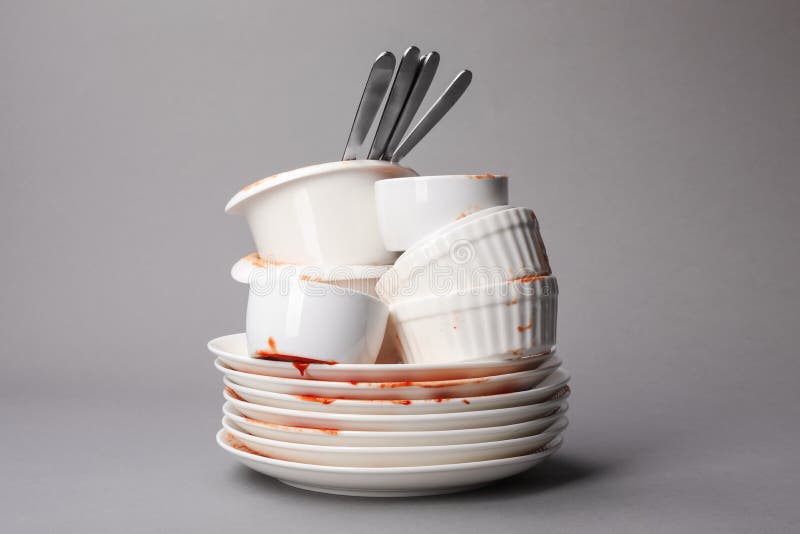
Locate an element on the screen. The height and width of the screenshot is (534, 800). plates is located at coordinates (404, 475), (392, 459), (386, 439), (390, 419), (394, 406), (401, 386), (402, 370).